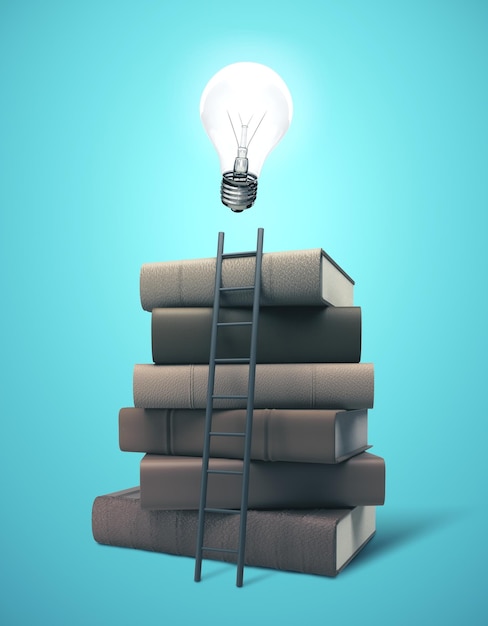
Where is `book spine`? The height and width of the screenshot is (626, 488). book spine is located at coordinates (179, 283), (178, 345), (174, 392), (163, 442), (171, 491), (167, 548).